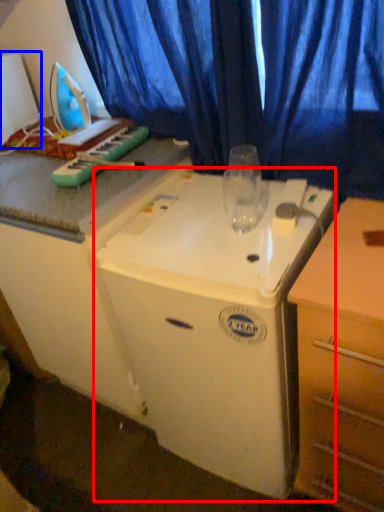
Question: Which object is further to the camera taking this photo, appliance (highlighted by a red box) or appliance (highlighted by a blue box)?

Choices:
 (A) appliance
 (B) appliance

Answer: (B)